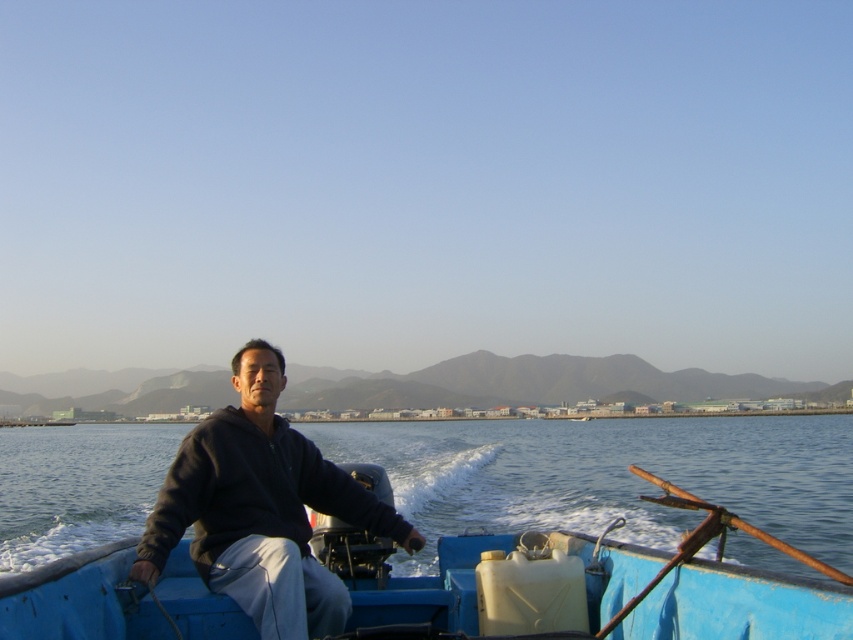
Locate an element on the screen. blue water at center is located at coordinates (610, 476).

Between blue water at center and dark blue sweatshirt at center, which one appears on the left side from the viewer's perspective?

From the viewer's perspective, blue water at center appears more on the left side.

Locate an element on the screen. blue water at center is located at coordinates (610, 476).